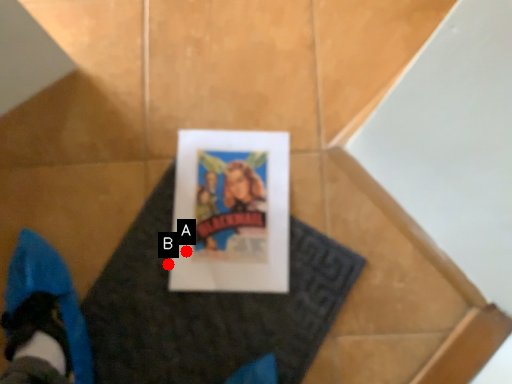
Question: Two points are circled on the image, labeled by A and B beside each circle. Which point is farther to the camera?

Choices:
 (A) A is further
 (B) B is further

Answer: (B)